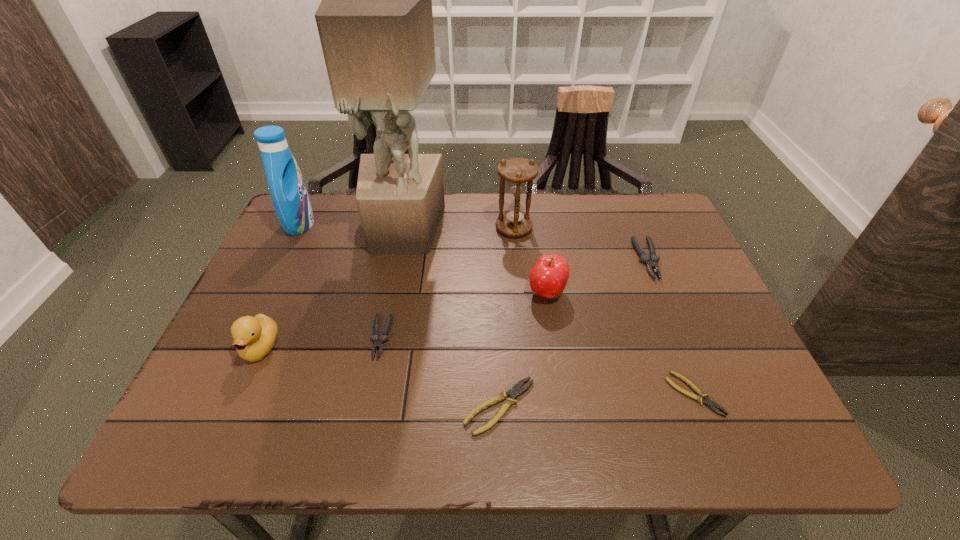
Locate an element on the screen. The image size is (960, 540). object that is at the far right corner is located at coordinates (651, 262).

Image resolution: width=960 pixels, height=540 pixels. What are the coordinates of `object that is at the near right corner` in the screenshot? It's located at pyautogui.click(x=712, y=405).

The width and height of the screenshot is (960, 540). Find the location of `vacant region at the far edge of the desktop`. vacant region at the far edge of the desktop is located at coordinates (457, 198).

Find the location of a particular element. This screenshot has height=540, width=960. vacant space at the near edge of the desktop is located at coordinates (417, 442).

This screenshot has height=540, width=960. Identify the location of vacant region at the left edge of the desktop. (269, 272).

Locate an element on the screen. free space at the right edge of the desktop is located at coordinates (723, 345).

Where is `vacant area at the far left corner of the desktop`? The height and width of the screenshot is (540, 960). vacant area at the far left corner of the desktop is located at coordinates (343, 199).

This screenshot has width=960, height=540. I want to click on vacant space at the far right corner of the desktop, so click(x=637, y=199).

Where is `free spot between the smaller gray pliers and the duckling`? Image resolution: width=960 pixels, height=540 pixels. free spot between the smaller gray pliers and the duckling is located at coordinates point(321,343).

The height and width of the screenshot is (540, 960). Identify the location of blank region between the duckling and the third shortest pliers. (321, 343).